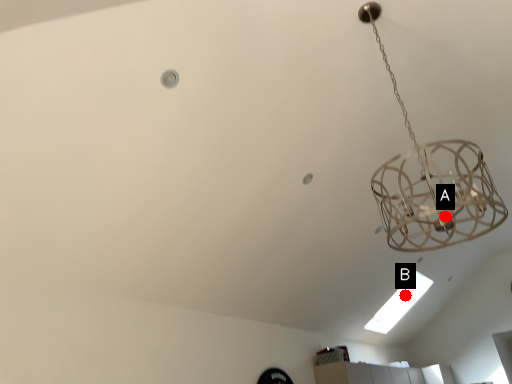
Question: Two points are circled on the image, labeled by A and B beside each circle. Which point is closer to the camera?

Choices:
 (A) A is closer
 (B) B is closer

Answer: (A)